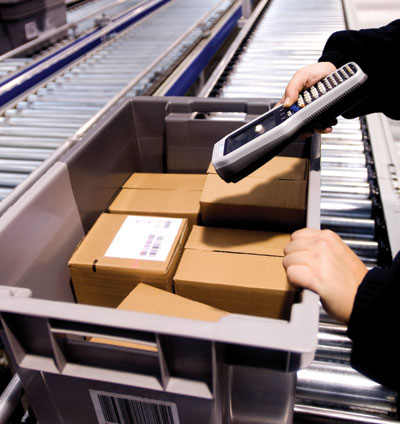
Locate an element on the screen. The image size is (400, 424). scanner is located at coordinates (244, 149).